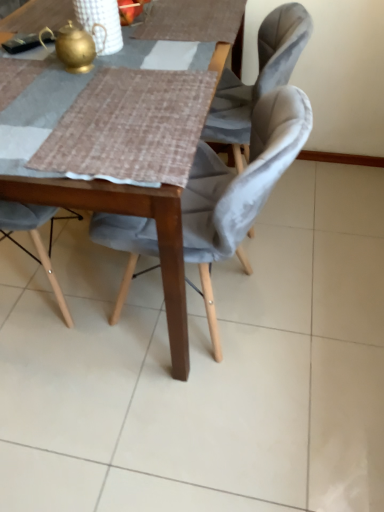
The image size is (384, 512). I want to click on vacant region to the left of gold metallic teapot at upper left, so click(27, 70).